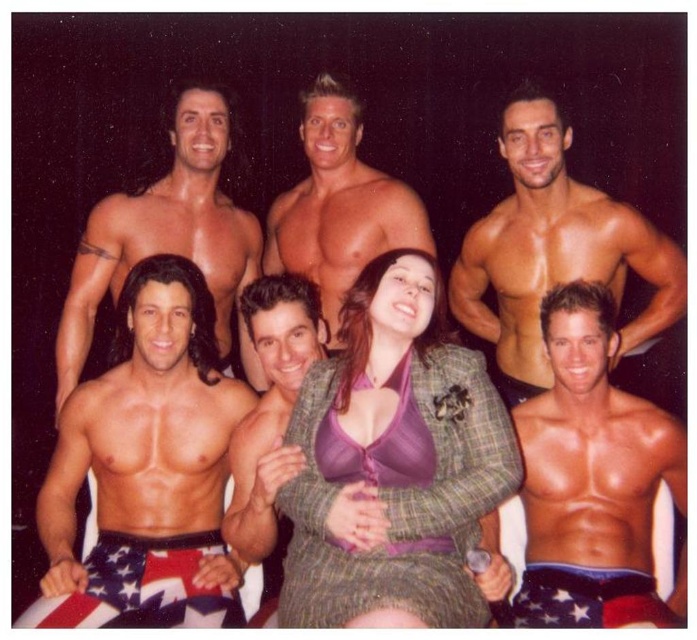
Question: Does muscular tan skin at upper center appear on the right side of smooth tan skin at center?

Choices:
 (A) yes
 (B) no

Answer: (A)

Question: Which object is positioned closest to the smooth tan skin at center?

Choices:
 (A) plaid fabric blazer at center
 (B) shiny metallic shorts at lower left
 (C) shiny skin torso at left

Answer: (C)

Question: Is plaid fabric blazer at center positioned before shiny skin torso at left?

Choices:
 (A) no
 (B) yes

Answer: (B)

Question: Does plaid fabric blazer at center lie in front of smooth skin torso at center?

Choices:
 (A) yes
 (B) no

Answer: (A)

Question: Estimate the real-world distances between objects in this image. Which object is closer to the plaid fabric blazer at center?

Choices:
 (A) muscular tan skin at upper center
 (B) smooth tan skin at center
 (C) smooth skin torso at center
 (D) shiny skin torso at left

Answer: (C)

Question: Which point is farther to the camera?

Choices:
 (A) (510, 252)
 (B) (599, 474)

Answer: (A)